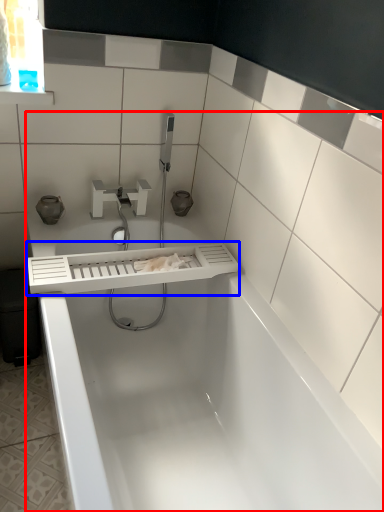
Question: Which object appears farthest to the camera in this image, bathtub (highlighted by a red box) or balustrade (highlighted by a blue box)?

Choices:
 (A) bathtub
 (B) balustrade

Answer: (B)